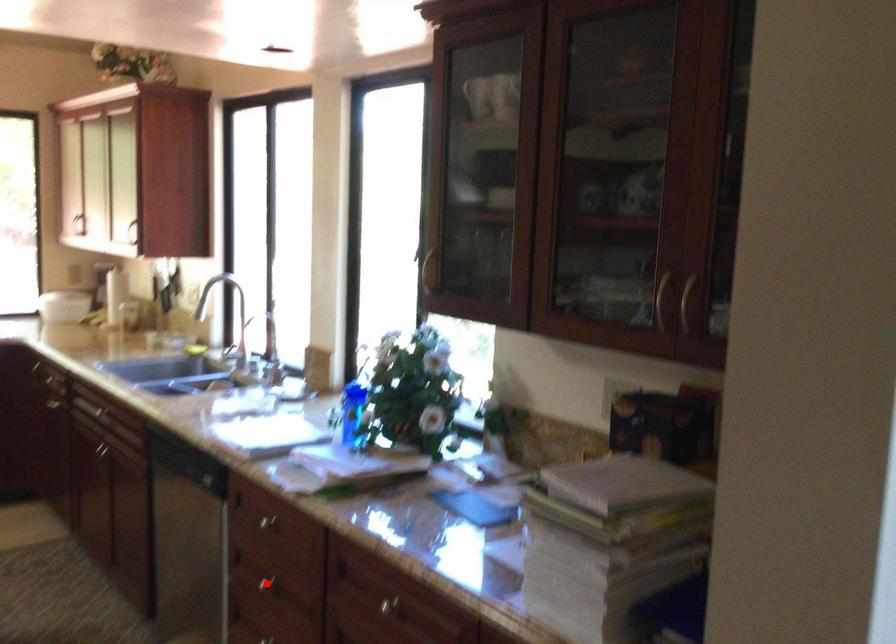
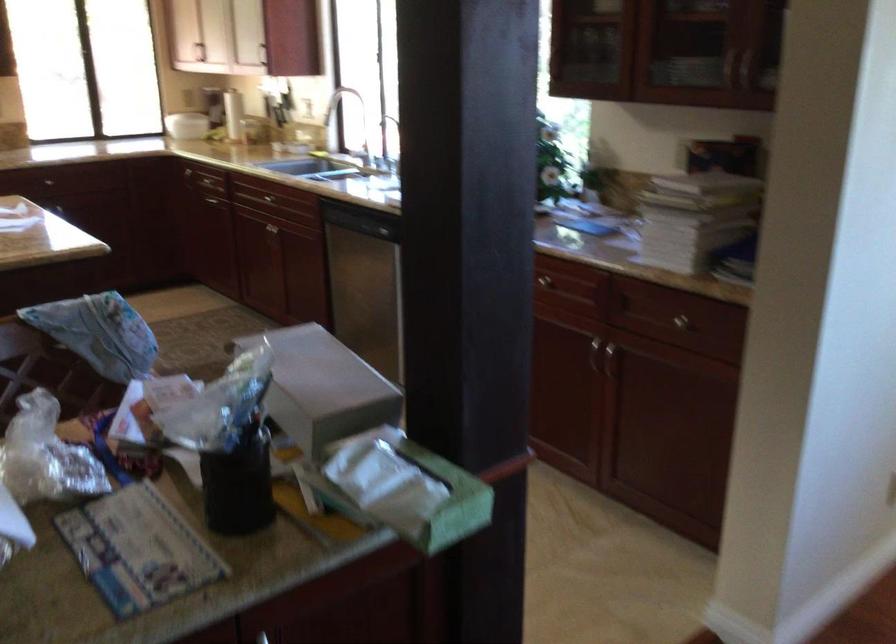
Question: I am providing you with two images of the same scene from different viewpoints. A red point is marked on the first image. At the location where the point appears in image 1, is it still visible in image 2?

Choices:
 (A) Yes
 (B) No

Answer: (B)